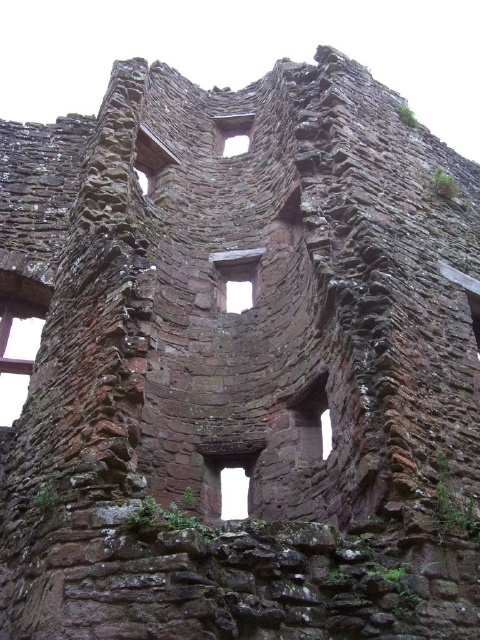
Question: In this image, where is brown stone window at left located relative to transparent stone window at center?

Choices:
 (A) below
 (B) above

Answer: (A)

Question: From the image, what is the correct spatial relationship of brown stone window at left in relation to transparent stone window at center?

Choices:
 (A) above
 (B) below

Answer: (B)

Question: Among these points, which one is nearest to the camera?

Choices:
 (A) [235, 268]
 (B) [14, 413]

Answer: (B)

Question: Which point is closer to the camera?

Choices:
 (A) brown stone window at left
 (B) transparent stone window at center

Answer: (A)

Question: Observing the image, what is the correct spatial positioning of brown stone window at left in reference to transparent stone window at center?

Choices:
 (A) below
 (B) above

Answer: (A)